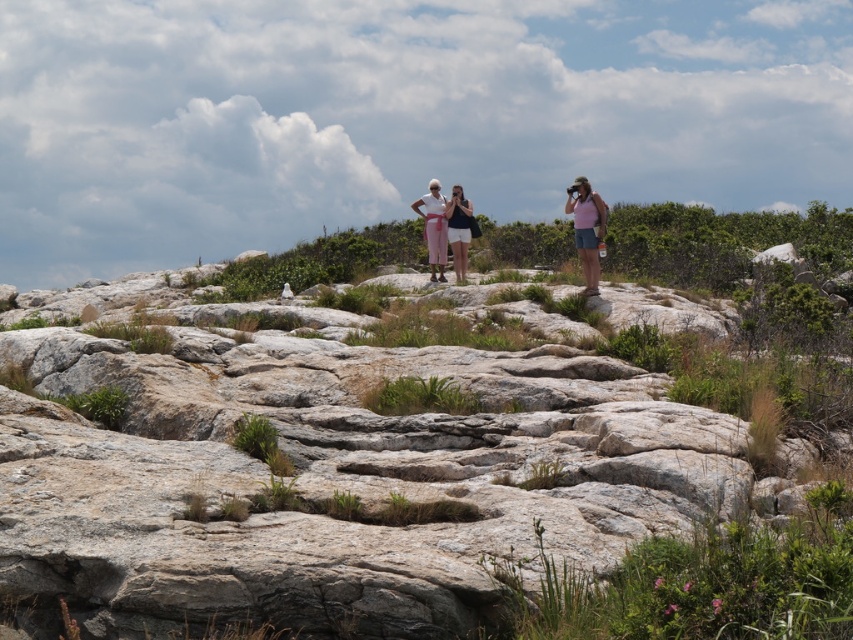
Question: Which of these objects is positioned closest to the matte white shorts at center?

Choices:
 (A) pink fabric at center
 (B) matte pink pants at center

Answer: (B)

Question: Among these objects, which one is farthest from the camera?

Choices:
 (A) pink fabric at center
 (B) matte white shorts at center
 (C) matte pink pants at center

Answer: (C)

Question: Estimate the real-world distances between objects in this image. Which object is closer to the matte white shorts at center?

Choices:
 (A) pink fabric at center
 (B) matte pink pants at center

Answer: (B)

Question: In this image, where is pink fabric at center located relative to matte pink pants at center?

Choices:
 (A) right
 (B) left

Answer: (A)

Question: Is pink fabric at center thinner than matte pink pants at center?

Choices:
 (A) no
 (B) yes

Answer: (B)

Question: Is the position of pink fabric at center more distant than that of matte pink pants at center?

Choices:
 (A) yes
 (B) no

Answer: (B)